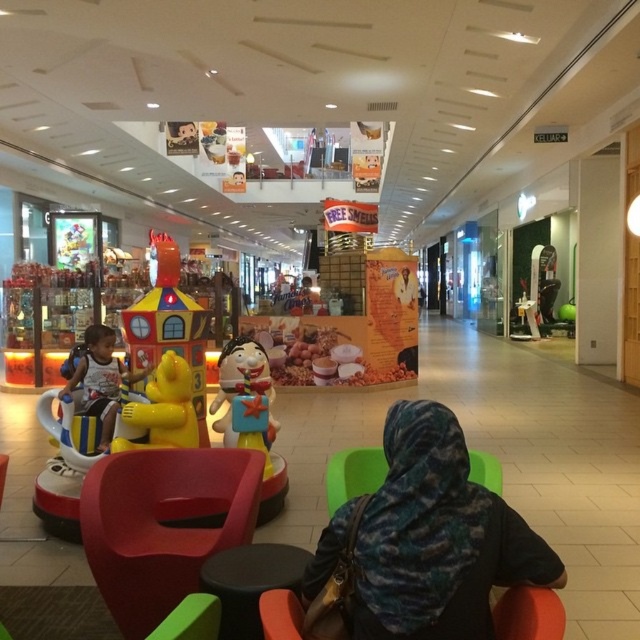
Question: Which of the following is the closest to the observer?

Choices:
 (A) (x=148, y=381)
 (B) (x=292, y=625)
 (C) (x=237, y=515)

Answer: (B)

Question: Which point is closer to the camera taking this photo?

Choices:
 (A) (140, 481)
 (B) (556, 600)

Answer: (B)

Question: In this image, where is matte red armchair at center located relative to rubber duck house at center?

Choices:
 (A) below
 (B) above

Answer: (A)

Question: Among these objects, which one is nearest to the camera?

Choices:
 (A) rubber duck house at center
 (B) camouflage fabric headscarf at center
 (C) camouflage fabric armchair at center
 (D) yellow matte bear at center

Answer: (B)

Question: Does camouflage fabric headscarf at center have a larger size compared to orange fabric armchair at lower center?

Choices:
 (A) no
 (B) yes

Answer: (B)

Question: Can you confirm if matte red armchair at center is wider than orange fabric armchair at lower center?

Choices:
 (A) no
 (B) yes

Answer: (B)